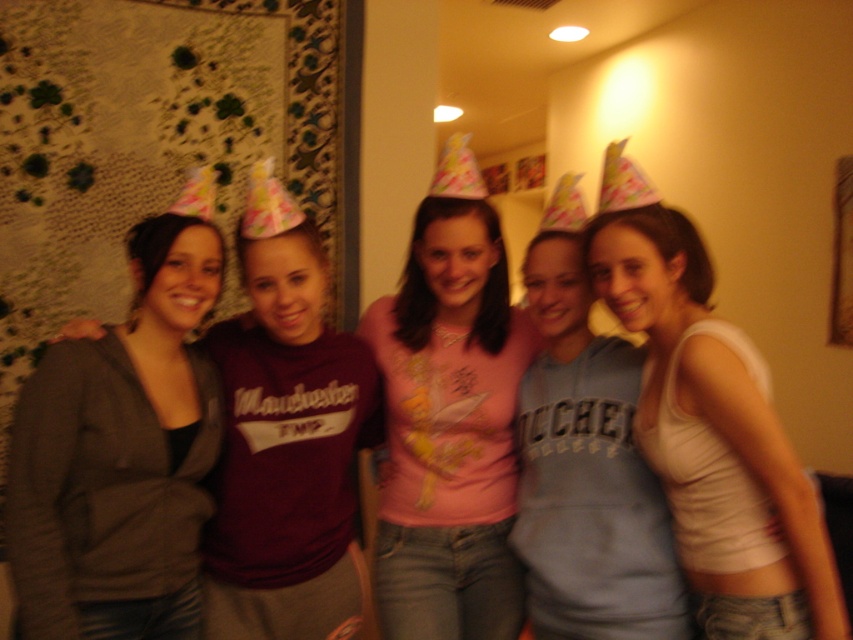
Question: Where is pink fabric shirt at center located in relation to white tank top at center in the image?

Choices:
 (A) left
 (B) right

Answer: (A)

Question: Where is matte gray hoodie at center located in relation to white tank top at center in the image?

Choices:
 (A) left
 (B) right

Answer: (A)

Question: Which object appears closest to the camera in this image?

Choices:
 (A) matte gray hoodie at center
 (B) white tank top at center

Answer: (B)

Question: Which point is closer to the camera taking this photo?

Choices:
 (A) (482, 454)
 (B) (618, 289)
 (C) (135, 480)

Answer: (B)

Question: Is pink fabric shirt at center to the left of white tank top at center from the viewer's perspective?

Choices:
 (A) no
 (B) yes

Answer: (B)

Question: Among these objects, which one is nearest to the camera?

Choices:
 (A) pink fabric shirt at center
 (B) white tank top at center

Answer: (B)